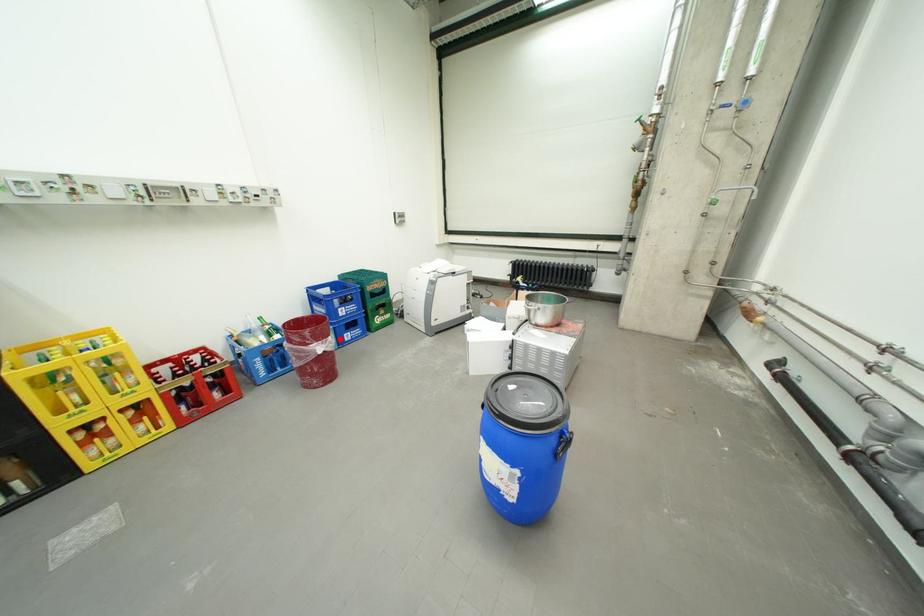
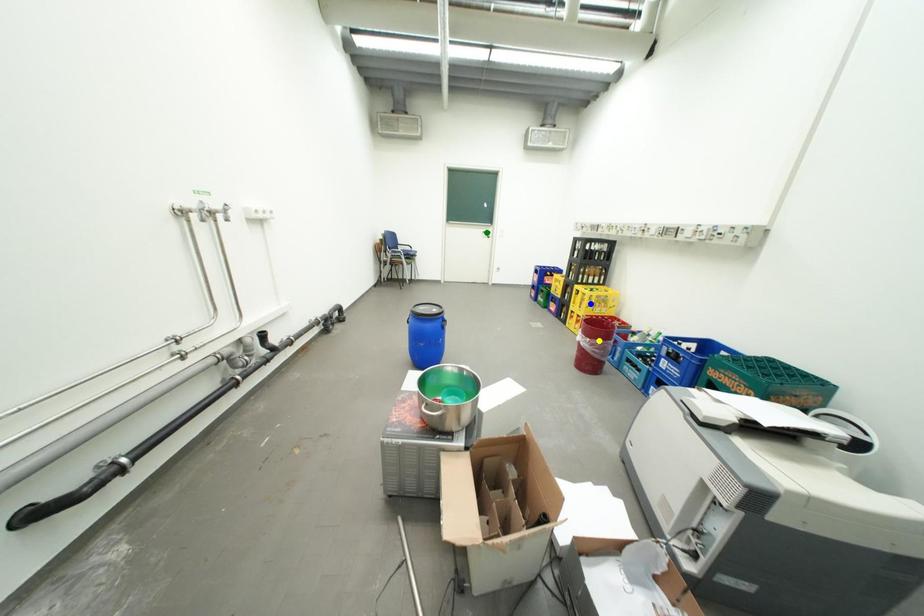
Question: I am providing you with two images of the same scene from different viewpoints. A red point is marked on the first image. You are given multiple points on the second image. Which point in image 2 represents the same 3d spot as the red point in image 1?

Choices:
 (A) yellow point
 (B) blue point
 (C) green point

Answer: (A)